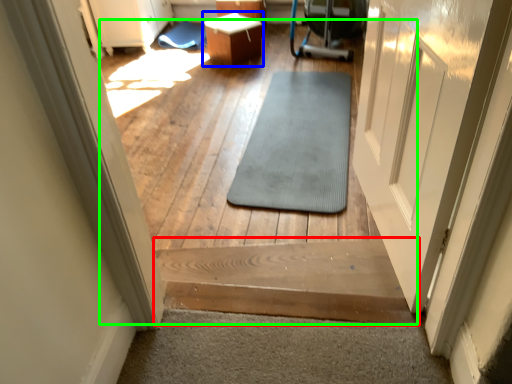
Question: Estimate the real-world distances between objects in this image. Which object is closer to stairs (highlighted by a red box), table (highlighted by a blue box) or path (highlighted by a green box)?

Choices:
 (A) table
 (B) path

Answer: (B)